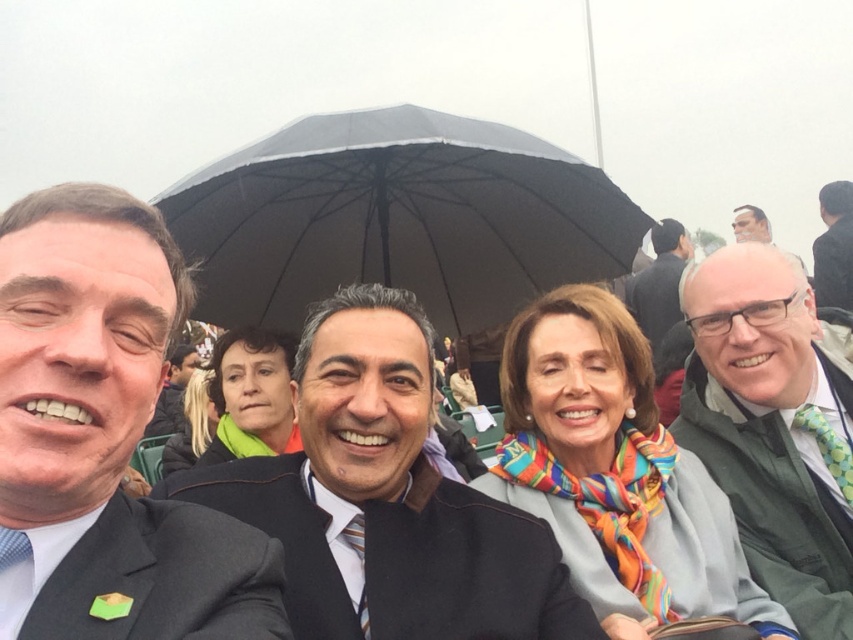
You are a photographer trying to capture a group photo of the people under the black matte umbrella at center and the dark gray suit at upper right. Considering their heights, which object will appear larger in the photo?

The black matte umbrella at center will appear larger in the photo because it is taller than the dark gray suit at upper right.

You are organizing a charity event and need to arrange seating based on the attendees clothing. You see the dark gray suit at upper right and the matte black jacket at center. Which attendee should you seat first if you are following the rule of seating smaller attire first?

The dark gray suit at upper right should be seated first because it is smaller than the matte black jacket at center according to the description.

Consider the image. You are standing at the center of the image and want to locate the dark gray suit at upper right. According to the coordinates provided, in which direction should you look to find it?

The dark gray suit at upper right is located at coordinates point (659,282), which means you should look towards the upper right direction from the center to find it.